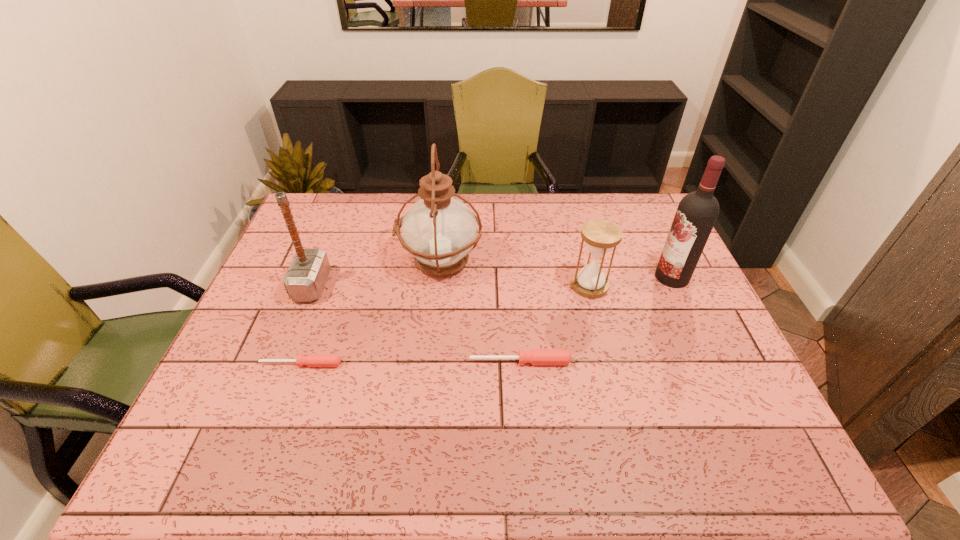
This screenshot has height=540, width=960. Find the location of `the shortest object`. the shortest object is located at coordinates (312, 360).

Where is `the shorter screwdriver`? The height and width of the screenshot is (540, 960). the shorter screwdriver is located at coordinates (x=312, y=360).

The height and width of the screenshot is (540, 960). I want to click on the right screwdriver, so click(536, 356).

At what (x,y) coordinates should I click in order to perform the action: click on the second shortest object. Please return your answer as a coordinate pair (x, y). Looking at the image, I should click on (536, 356).

Where is `oil lamp`? oil lamp is located at coordinates (439, 231).

Locate an element on the screen. hammer is located at coordinates (305, 279).

Find the location of a particular element. Image resolution: width=960 pixels, height=540 pixels. hourglass is located at coordinates pyautogui.click(x=600, y=236).

This screenshot has width=960, height=540. Find the location of `the second object from right to left`. the second object from right to left is located at coordinates (600, 236).

This screenshot has height=540, width=960. I want to click on wine bottle, so click(x=697, y=212).

You are a GUI agent. You are given a task and a screenshot of the screen. Output one action in this format:
    pyautogui.click(x=<x>, y=<y>)
    Task: Click on the vacant space located on the back of the shortest object
    This screenshot has width=960, height=540.
    Given the screenshot: What is the action you would take?
    pyautogui.click(x=322, y=307)